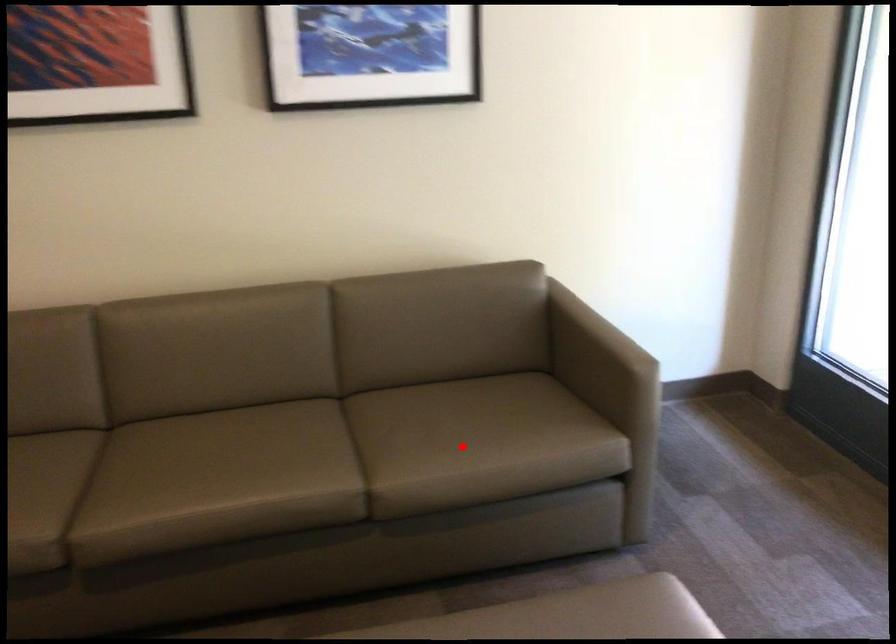
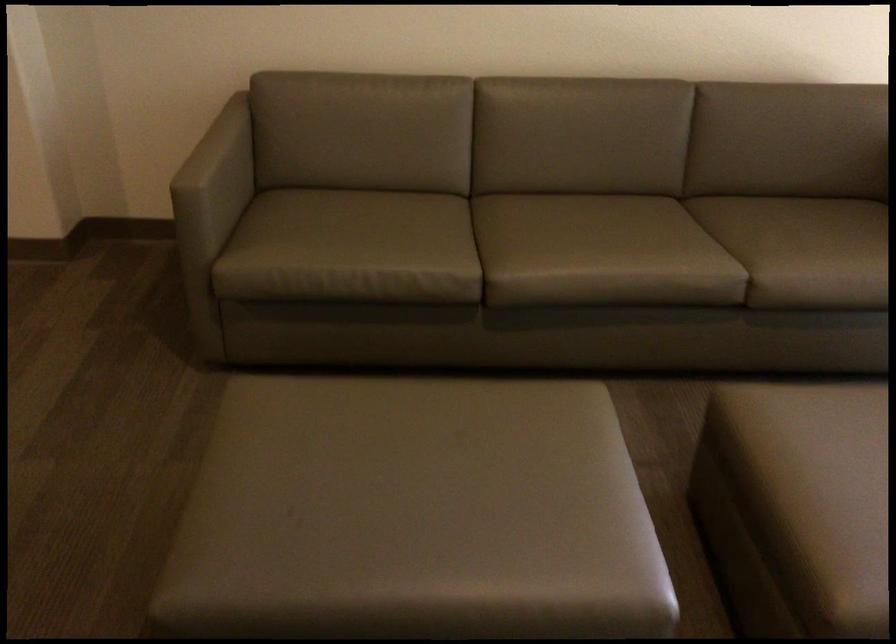
The point at the highlighted location is marked in the first image. Where is the corresponding point in the second image?

(819, 251)